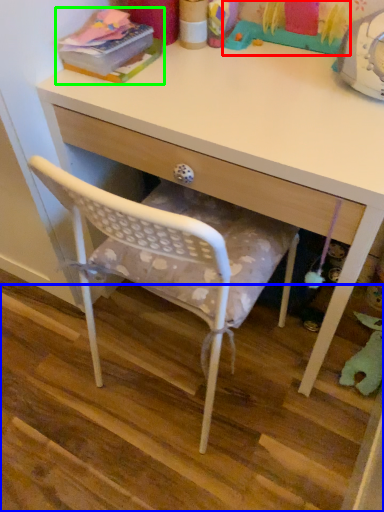
Question: Which is farther away from toy (highlighted by a red box)? stair (highlighted by a blue box) or book (highlighted by a green box)?

Choices:
 (A) stair
 (B) book

Answer: (A)